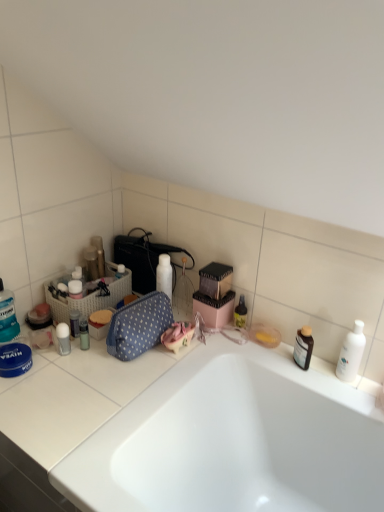
The width and height of the screenshot is (384, 512). I want to click on vacant area located to the right-hand side of white glossy deodorant at left, which is the ninth toiletry in right-to-left order, so click(x=107, y=365).